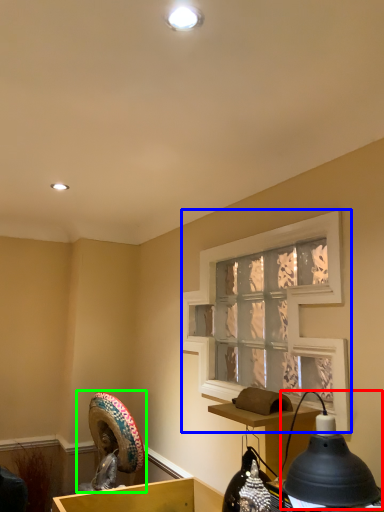
Question: Estimate the real-world distances between objects in this image. Which object is closer to lamp (highlighted by a red box), window screen (highlighted by a blue box) or sculpture (highlighted by a green box)?

Choices:
 (A) window screen
 (B) sculpture

Answer: (A)